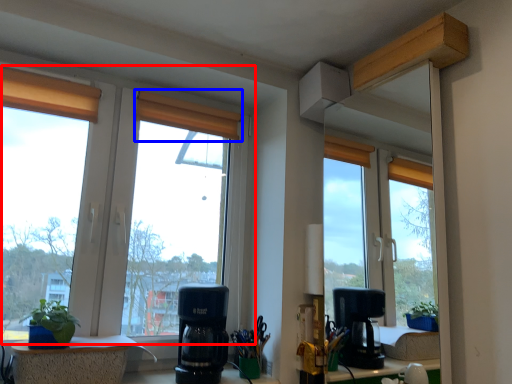
Question: Which object appears farthest to the camera in this image, window (highlighted by a red box) or curtain (highlighted by a blue box)?

Choices:
 (A) window
 (B) curtain

Answer: (B)